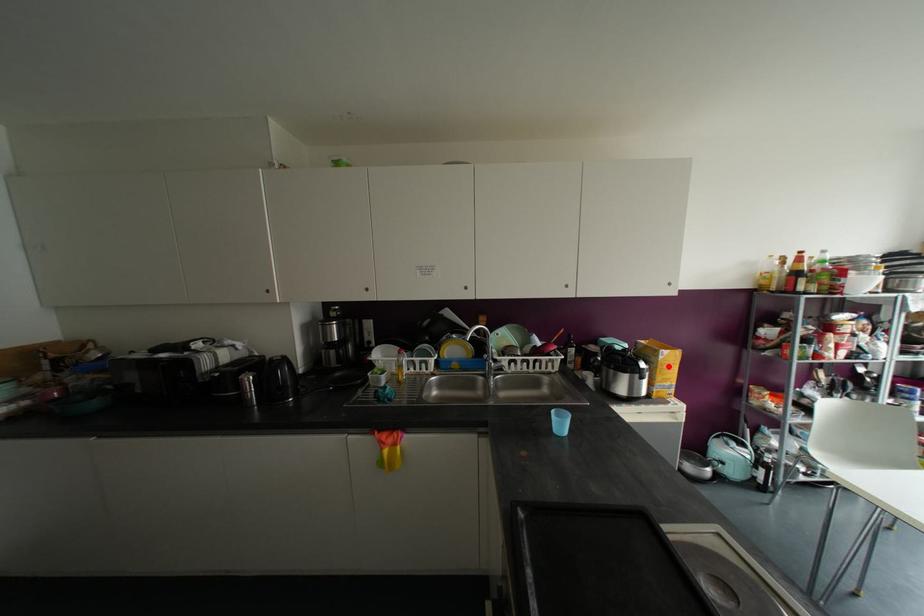
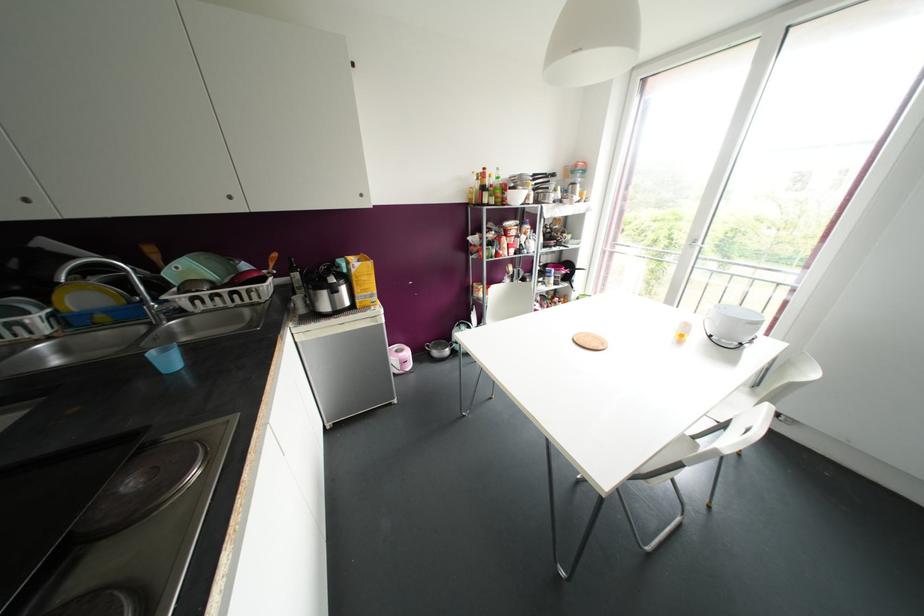
Find the pixel in the second image that matches the highlighted location in the first image.

(363, 277)